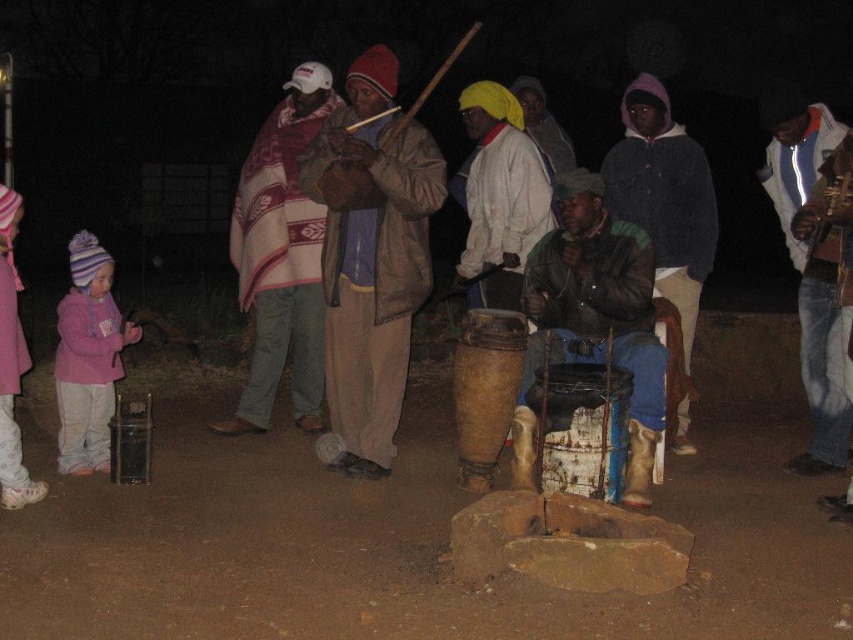
You are at the nighttime gathering and want to locate the pink fleece jacket at lower left. Which direction should you look relative to the matte brown drum at center?

The pink fleece jacket at lower left is to the left of the matte brown drum at center.

You are organizing a small outdoor gathering and want to ensure there is enough space for both the plaid woolen blanket at center and the matte brown drum at center. Based on the scene description, which object takes up more horizontal space?

The plaid woolen blanket at center has a larger width than the matte brown drum at center, so it occupies more horizontal space.

You are a performer preparing to sit down near the plaid woolen blanket at center and the matte brown drum at center. Can you comfortably sit between them if you need 1 meter of space to spread your legs?

The plaid woolen blanket at center and matte brown drum at center are 1.25 meters apart from each other. Since you need 1 meter of space, yes, you can comfortably sit between them as the distance is sufficient.